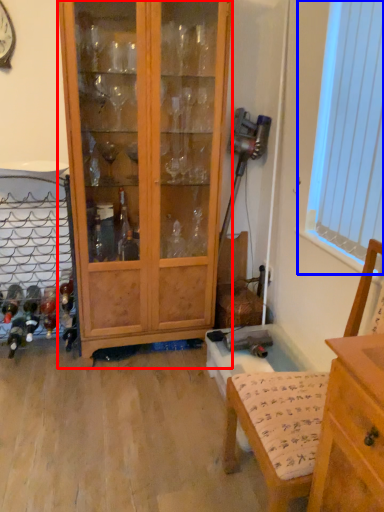
Question: Among these objects, which one is nearest to the camera, cabinetry (highlighted by a red box) or window screen (highlighted by a blue box)?

Choices:
 (A) cabinetry
 (B) window screen

Answer: (B)